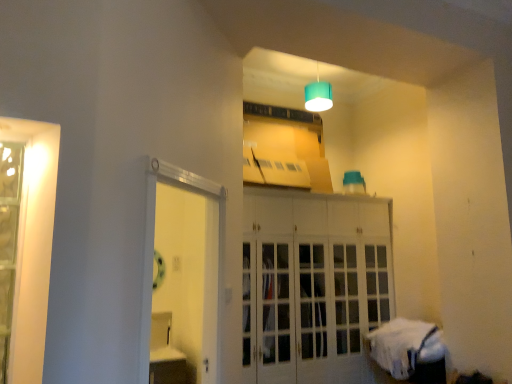
Question: Is white glass cabinet at center outside clear glass door at left?

Choices:
 (A) yes
 (B) no

Answer: (A)

Question: Is white glass cabinet at center positioned in front of clear glass door at left?

Choices:
 (A) yes
 (B) no

Answer: (B)

Question: Is white glass cabinet at center to the right of clear glass door at left from the viewer's perspective?

Choices:
 (A) yes
 (B) no

Answer: (A)

Question: From a real-world perspective, is white glass cabinet at center located beneath clear glass door at left?

Choices:
 (A) no
 (B) yes

Answer: (B)

Question: Are white glass cabinet at center and clear glass door at left located far from each other?

Choices:
 (A) no
 (B) yes

Answer: (B)

Question: Considering the positions of white fabric bed at lower right and teal fabric lampshade at upper center in the image, is white fabric bed at lower right bigger or smaller than teal fabric lampshade at upper center?

Choices:
 (A) big
 (B) small

Answer: (A)

Question: Is white fabric bed at lower right taller or shorter than teal fabric lampshade at upper center?

Choices:
 (A) tall
 (B) short

Answer: (B)

Question: Based on their positions, is white fabric bed at lower right located to the left or right of teal fabric lampshade at upper center?

Choices:
 (A) left
 (B) right

Answer: (B)

Question: Is point (400, 339) closer or farther from the camera than point (327, 96)?

Choices:
 (A) closer
 (B) farther

Answer: (A)

Question: From a real-world perspective, is white glass cabinet at center above or below clear glass door at left?

Choices:
 (A) above
 (B) below

Answer: (B)

Question: Considering the positions of point (275, 261) and point (22, 264), is point (275, 261) closer or farther from the camera than point (22, 264)?

Choices:
 (A) farther
 (B) closer

Answer: (A)

Question: Is white glass cabinet at center wider or thinner than clear glass door at left?

Choices:
 (A) thin
 (B) wide

Answer: (B)

Question: From the image's perspective, is white glass cabinet at center positioned above or below clear glass door at left?

Choices:
 (A) above
 (B) below

Answer: (B)

Question: Based on their positions, is clear glass door at left located to the left or right of white glossy door at center?

Choices:
 (A) left
 (B) right

Answer: (A)

Question: Looking at their shapes, would you say clear glass door at left is wider or thinner than white glossy door at center?

Choices:
 (A) thin
 (B) wide

Answer: (A)